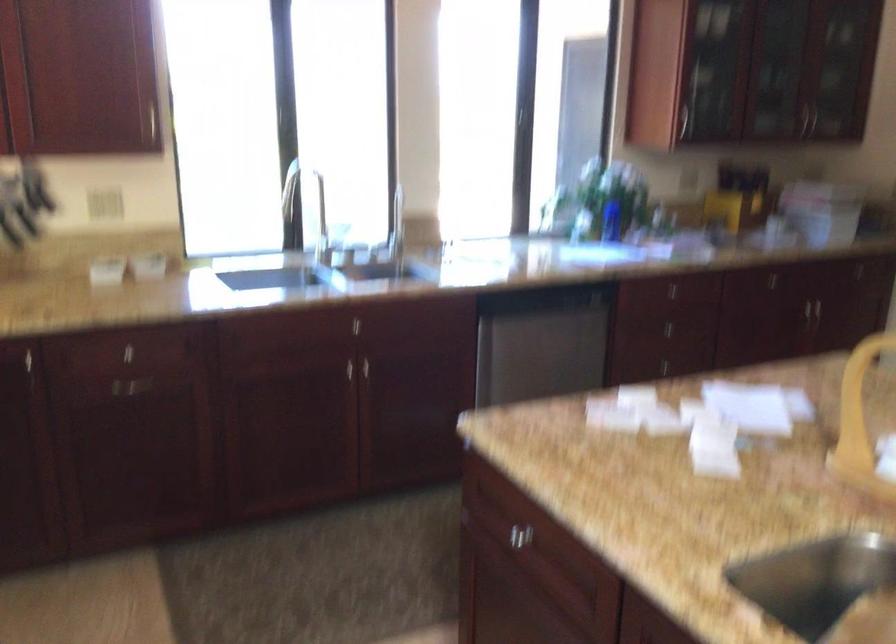
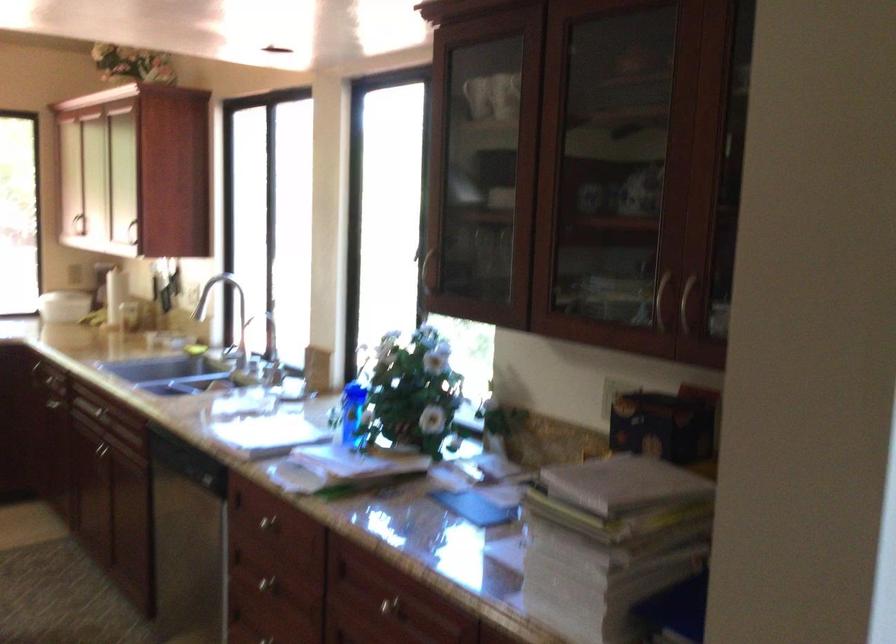
In the second image, find the point that corresponds to point (694, 281) in the first image.

(268, 522)